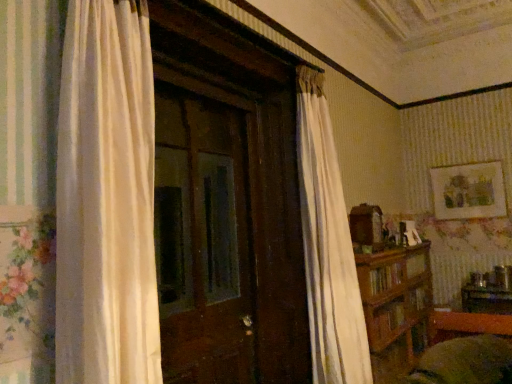
What do you see at coordinates (486, 299) in the screenshot?
I see `wooden table at lower right` at bounding box center [486, 299].

At what (x,y) coordinates should I click in order to perform the action: click on brown wooden bookshelf at right. Please return your answer as a coordinate pair (x, y). Image resolution: width=512 pixels, height=384 pixels. Looking at the image, I should click on (396, 306).

In order to face matte gold picture frame at upper right, should I rotate leftwards or rightwards?

A 26.436 degree turn to the right will do.

Identify the location of wooden table at lower right. (486, 299).

Does wooden table at lower right touch brown wooden bookshelf at right?

No, wooden table at lower right is not in contact with brown wooden bookshelf at right.

Does wooden table at lower right contain brown wooden bookshelf at right?

Definitely not — brown wooden bookshelf at right is not inside wooden table at lower right.

Is point (494, 302) behind point (416, 314)?

That is True.

Locate an element on the screen. furniture below the matte gold picture frame at upper right (from a real-world perspective) is located at coordinates (396, 306).

From the image's perspective, relative to matte gold picture frame at upper right, is brown wooden bookshelf at right above or below?

Based on their image positions, brown wooden bookshelf at right is located beneath matte gold picture frame at upper right.

Which point is more distant from viewer, (382, 313) or (479, 208)?

The point (479, 208) is behind.

Is brown wooden bookshelf at right inside the boundaries of matte gold picture frame at upper right, or outside?

brown wooden bookshelf at right is located beyond the bounds of matte gold picture frame at upper right.

Considering the relative sizes of wooden table at lower right and matte gold picture frame at upper right in the image provided, is wooden table at lower right wider than matte gold picture frame at upper right?

Indeed, wooden table at lower right has a greater width compared to matte gold picture frame at upper right.

From their relative heights in the image, would you say wooden table at lower right is taller or shorter than matte gold picture frame at upper right?

wooden table at lower right is shorter than matte gold picture frame at upper right.

From a real-world perspective, which object stands above the other?

matte gold picture frame at upper right.

Looking at this image, would you say wooden table at lower right is to the left or to the right of matte gold picture frame at upper right in the picture?

From the image, it's evident that wooden table at lower right is to the right of matte gold picture frame at upper right.

Which of these two, matte gold picture frame at upper right or brown wooden bookshelf at right, stands shorter?

With less height is matte gold picture frame at upper right.

Which point is more distant from viewer, (x=462, y=190) or (x=398, y=309)?

The point (x=462, y=190) is farther from the camera.

From a real-world perspective, relative to brown wooden bookshelf at right, is matte gold picture frame at upper right vertically above or below?

matte gold picture frame at upper right is above brown wooden bookshelf at right.

Is matte gold picture frame at upper right bigger or smaller than brown wooden bookshelf at right?

matte gold picture frame at upper right is smaller than brown wooden bookshelf at right.

Who is taller, matte gold picture frame at upper right or wooden table at lower right?

matte gold picture frame at upper right is taller.

Is matte gold picture frame at upper right facing away from wooden table at lower right?

No.

Choose the correct answer: Is matte gold picture frame at upper right inside wooden table at lower right or outside it?

matte gold picture frame at upper right is not enclosed by wooden table at lower right.

Is point (457, 188) positioned before point (494, 302)?

No, it is behind (494, 302).

Is brown wooden bookshelf at right inside the boundaries of wooden table at lower right, or outside?

brown wooden bookshelf at right is spatially situated outside wooden table at lower right.

Which object is further away from the camera taking this photo, brown wooden bookshelf at right or wooden table at lower right?

wooden table at lower right is more distant.

Considering the sizes of brown wooden bookshelf at right and wooden table at lower right in the image, is brown wooden bookshelf at right wider or thinner than wooden table at lower right?

In the image, brown wooden bookshelf at right appears to be more narrow than wooden table at lower right.

From the image's perspective, which object appears higher, brown wooden bookshelf at right or wooden table at lower right?

From the image's view, brown wooden bookshelf at right is above.

I want to click on furniture on the left of wooden table at lower right, so (x=396, y=306).

Locate an element on the screen. The height and width of the screenshot is (384, 512). furniture below the matte gold picture frame at upper right (from the image's perspective) is located at coordinates (396, 306).

From the image, which object appears to be nearer to matte gold picture frame at upper right, brown wooden bookshelf at right or wooden table at lower right?

wooden table at lower right is closer to matte gold picture frame at upper right.

Based on the photo, based on their spatial positions, is matte gold picture frame at upper right or wooden table at lower right further from brown wooden bookshelf at right?

The object further to brown wooden bookshelf at right is matte gold picture frame at upper right.

Which object lies nearer to the anchor point wooden table at lower right, matte gold picture frame at upper right or brown wooden bookshelf at right?

Based on the image, brown wooden bookshelf at right appears to be nearer to wooden table at lower right.

Considering their positions, is wooden table at lower right positioned further to matte gold picture frame at upper right than brown wooden bookshelf at right?

brown wooden bookshelf at right lies further to matte gold picture frame at upper right than the other object.

Considering their positions, is wooden table at lower right positioned closer to brown wooden bookshelf at right than matte gold picture frame at upper right?

wooden table at lower right is closer to brown wooden bookshelf at right.

From the image, which object appears to be nearer to wooden table at lower right, brown wooden bookshelf at right or matte gold picture frame at upper right?

brown wooden bookshelf at right lies closer to wooden table at lower right than the other object.

Image resolution: width=512 pixels, height=384 pixels. In order to click on table positioned between brown wooden bookshelf at right and matte gold picture frame at upper right from near to far in this screenshot , I will do `click(486, 299)`.